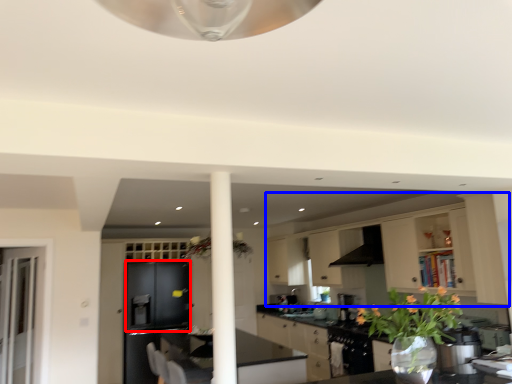
Question: Among these objects, which one is nearest to the camera, cabinetry (highlighted by a red box) or cabinetry (highlighted by a blue box)?

Choices:
 (A) cabinetry
 (B) cabinetry

Answer: (B)